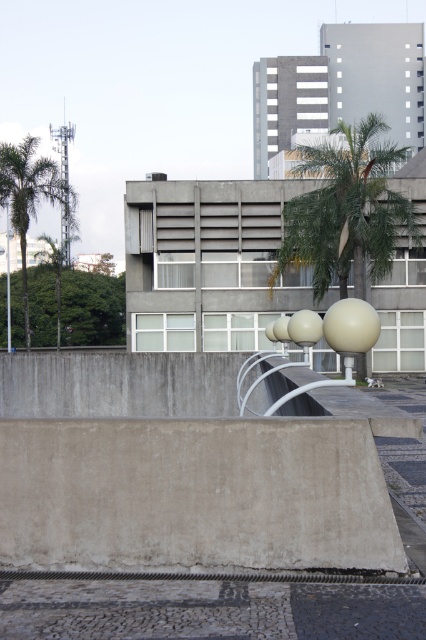
Question: Which object is farther from the camera taking this photo?

Choices:
 (A) concrete at center
 (B) green leafy palm tree at upper right
 (C) green leafy palm tree at left
 (D) gray concrete at lower center

Answer: (C)

Question: Which is nearer to the gray concrete at lower center?

Choices:
 (A) green leafy palm tree at upper right
 (B) concrete at center
 (C) green leafy palm tree at left

Answer: (B)

Question: Is gray concrete at lower center thinner than green leafy palm tree at left?

Choices:
 (A) yes
 (B) no

Answer: (A)

Question: Can you confirm if green leafy palm tree at upper right is thinner than green leafy palm tree at left?

Choices:
 (A) no
 (B) yes

Answer: (B)

Question: Can you confirm if gray concrete at lower center is wider than green leafy palm tree at left?

Choices:
 (A) no
 (B) yes

Answer: (A)

Question: Which is farther from the gray concrete at lower center?

Choices:
 (A) concrete at center
 (B) green leafy palm tree at left
 (C) green leafy palm tree at upper right

Answer: (B)